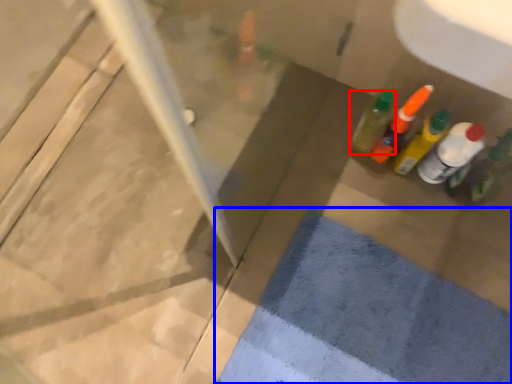
Question: Which object appears closest to the camera in this image, bottle (highlighted by a red box) or bath mat (highlighted by a blue box)?

Choices:
 (A) bottle
 (B) bath mat

Answer: (B)